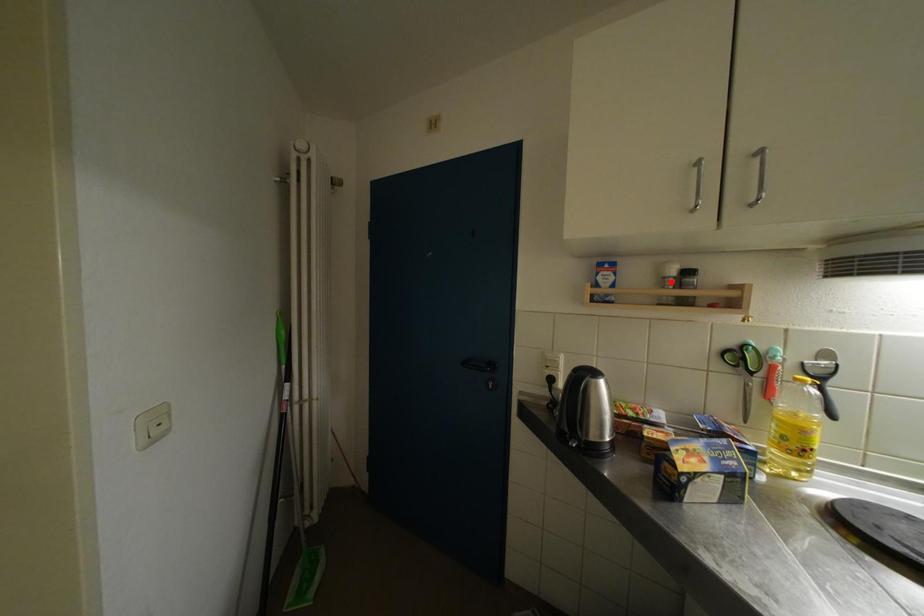
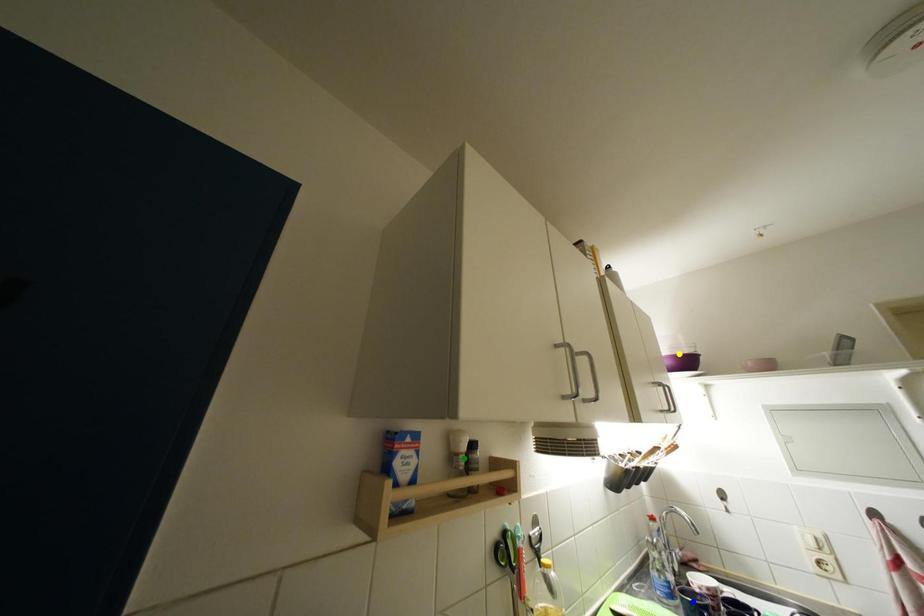
Question: I am providing you with two images of the same scene from different viewpoints. A red point is marked on the first image. You are given multiple points on the second image. Which point in image 2 is actually the same real-world point as the red point in image 1?

Choices:
 (A) green point
 (B) blue point
 (C) yellow point

Answer: (A)